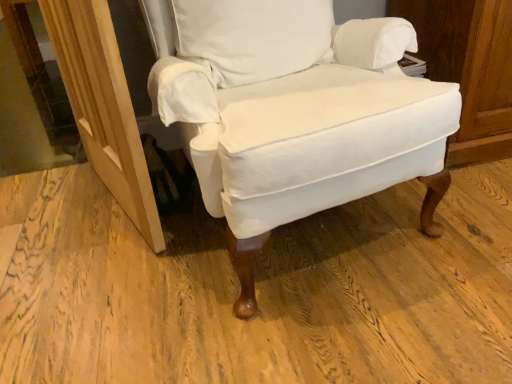
Question: Looking at their shapes, would you say wooden screen door at lower left is wider or thinner than white fabric chair at center?

Choices:
 (A) wide
 (B) thin

Answer: (B)

Question: From a real-world perspective, is wooden screen door at lower left above or below white fabric chair at center?

Choices:
 (A) below
 (B) above

Answer: (A)

Question: Based on their relative distances, which object is farther from the wooden screen door at lower left?

Choices:
 (A) white fabric chair at center
 (B) white cotton pillow at center

Answer: (B)

Question: Estimate the real-world distances between objects in this image. Which object is closer to the white cotton pillow at center?

Choices:
 (A) white fabric chair at center
 (B) wooden screen door at lower left

Answer: (A)